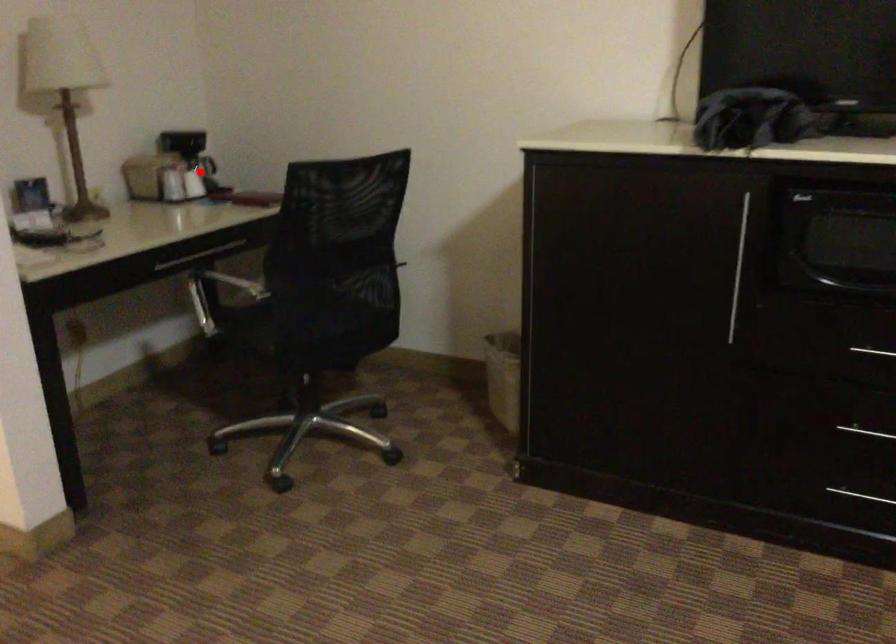
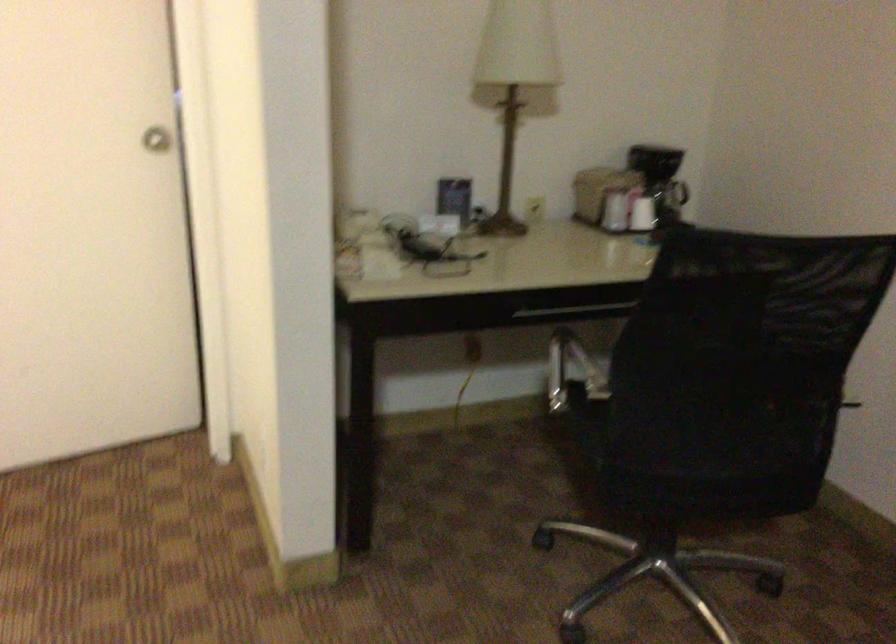
Where in the second image is the point corresponding to the highlighted location from the first image?

(677, 202)